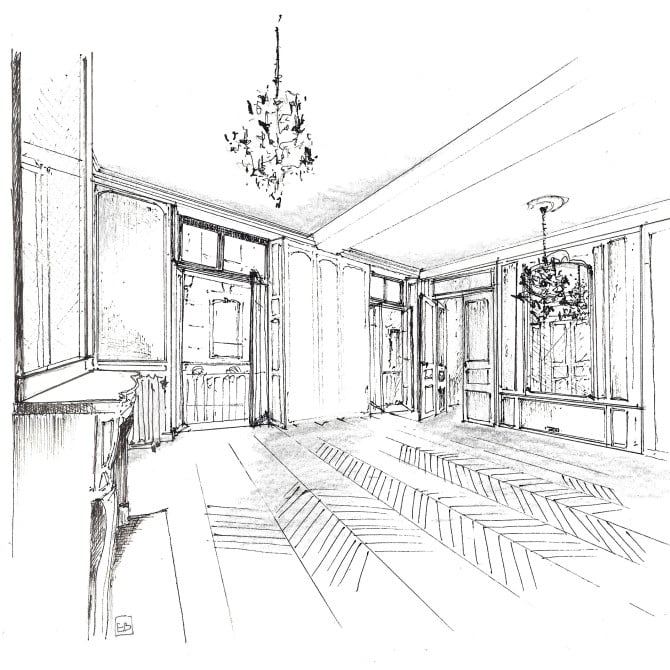
I want to click on wardrobe, so tap(336, 340).